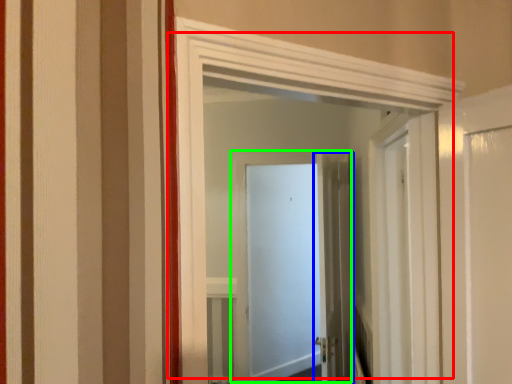
Question: Based on their relative distances, which object is nearer to door (highlighted by a red box)? Choose from door (highlighted by a blue box) and door (highlighted by a green box).

Choices:
 (A) door
 (B) door

Answer: (A)